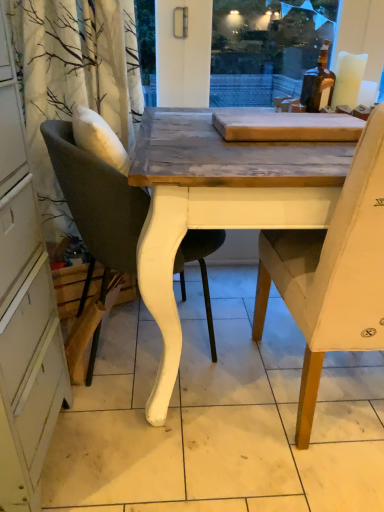
Find the location of a particular element. This screenshot has height=512, width=384. free point in front of matte gray cushioned chair at left, the first chair when ordered from left to right is located at coordinates (155, 443).